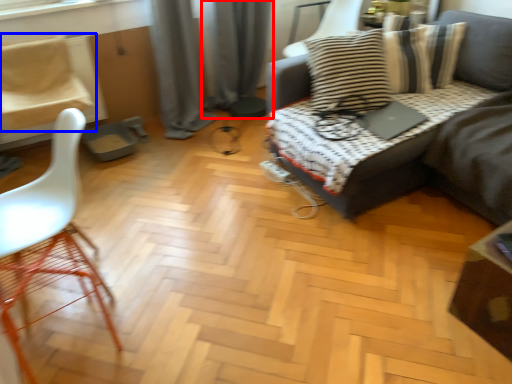
Question: Among these objects, which one is farthest to the camera, curtain (highlighted by a red box) or chair (highlighted by a blue box)?

Choices:
 (A) curtain
 (B) chair

Answer: (A)